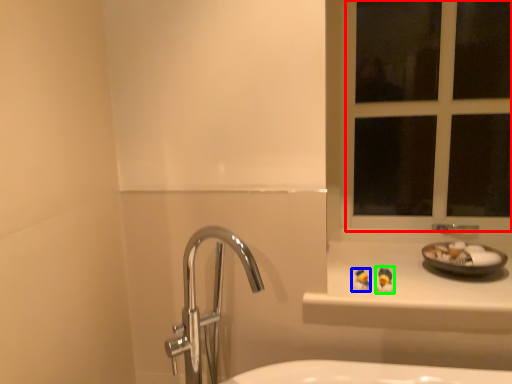
Question: Estimate the real-world distances between objects in this image. Which object is closer to window frame (highlighted by a red box), miniature (highlighted by a blue box) or miniature (highlighted by a green box)?

Choices:
 (A) miniature
 (B) miniature

Answer: (B)